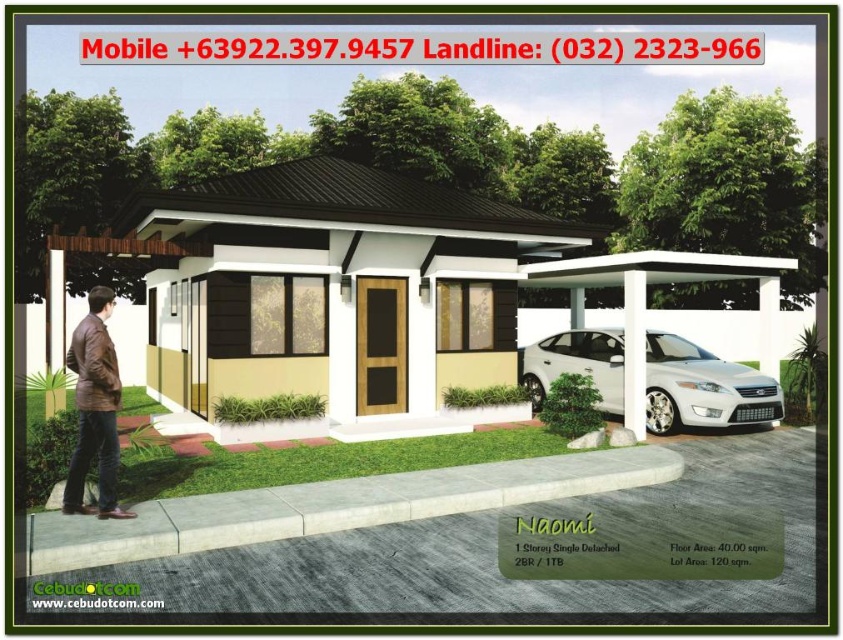
Question: Which point is farther to the camera?

Choices:
 (A) (642, 292)
 (B) (604, 371)
 (C) (114, 480)

Answer: (B)

Question: Can you confirm if white glossy sedan at center is wider than white smooth pillar at right?

Choices:
 (A) yes
 (B) no

Answer: (A)

Question: Can you confirm if white glossy sedan at center is positioned to the right of brown leather jacket at lower left?

Choices:
 (A) yes
 (B) no

Answer: (A)

Question: Considering the real-world distances, which object is farthest from the brown leather jacket at lower left?

Choices:
 (A) white glossy sedan at center
 (B) white smooth pillar at right

Answer: (A)

Question: Does white glossy sedan at center appear on the left side of white smooth pillar at right?

Choices:
 (A) yes
 (B) no

Answer: (A)

Question: Which of these objects is positioned closest to the brown leather jacket at lower left?

Choices:
 (A) white smooth pillar at right
 (B) white glossy sedan at center

Answer: (A)